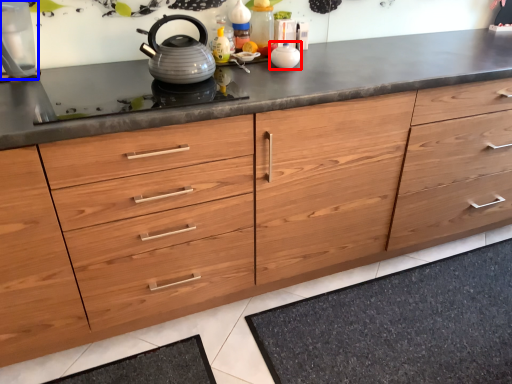
Question: Which object appears farthest to the camera in this image, appliance (highlighted by a red box) or appliance (highlighted by a blue box)?

Choices:
 (A) appliance
 (B) appliance

Answer: (A)